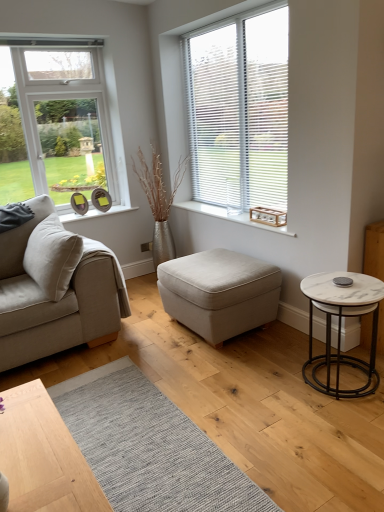
This screenshot has width=384, height=512. In order to click on vacant space in between white marble side table at right and light beige fabric ottoman at center in this screenshot , I will do click(x=274, y=358).